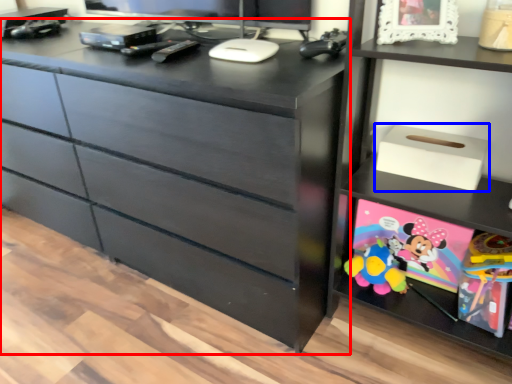
Question: Which of the following is the closest to the observer, chest of drawers (highlighted by a red box) or storage box (highlighted by a blue box)?

Choices:
 (A) chest of drawers
 (B) storage box

Answer: (A)